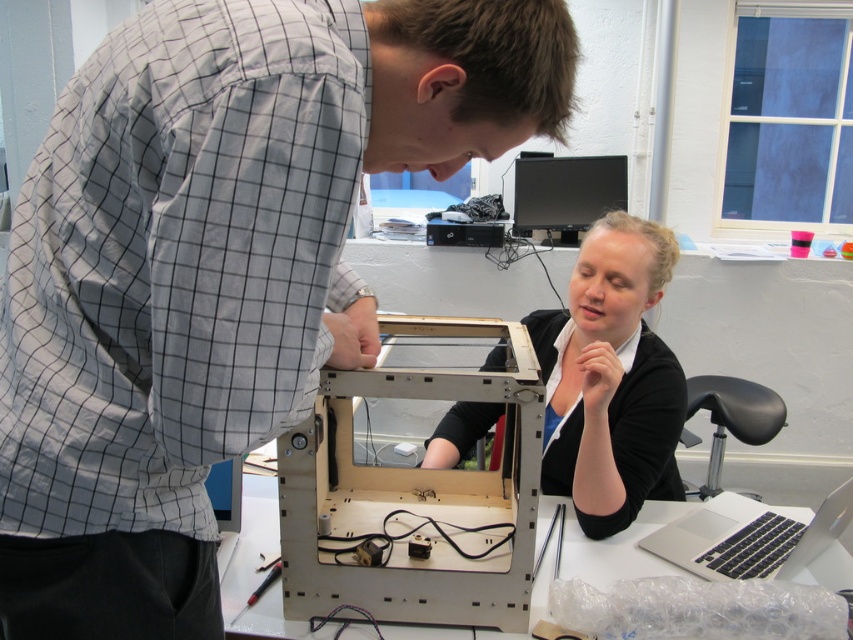
Can you confirm if silver metallic laptop at lower right is bigger than black glossy monitor at upper center?

No.

At what (x,y) coordinates should I click in order to perform the action: click on silver metallic laptop at lower right. Please return your answer as a coordinate pair (x, y). The width and height of the screenshot is (853, 640). Looking at the image, I should click on coord(755,540).

Does point (711, 566) come closer to viewer compared to point (570, 196)?

Yes, point (711, 566) is closer to viewer.

Image resolution: width=853 pixels, height=640 pixels. I want to click on silver metallic laptop at lower right, so click(x=755, y=540).

Is white plastic table at center further to the viewer compared to black glossy monitor at upper center?

No, white plastic table at center is in front of black glossy monitor at upper center.

Is white plastic table at center smaller than black glossy monitor at upper center?

No.

Who is more distant from viewer, (428, 637) or (611, 196)?

The point (611, 196) is more distant.

At what (x,y) coordinates should I click in order to perform the action: click on white plastic table at center. Please return your answer as a coordinate pair (x, y). Looking at the image, I should click on (258, 572).

Which is behind, point (492, 593) or point (546, 376)?

Positioned behind is point (546, 376).

Who is higher up, metallic silver electronics at center or black matte laptop at center?

black matte laptop at center is above.

Locate an element on the screen. This screenshot has width=853, height=640. metallic silver electronics at center is located at coordinates (415, 497).